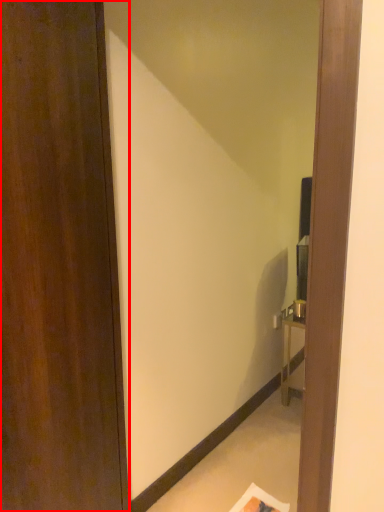
Question: From the image's perspective, what is the correct spatial relationship of door (annotated by the red box) in relation to mirror?

Choices:
 (A) below
 (B) above

Answer: (A)